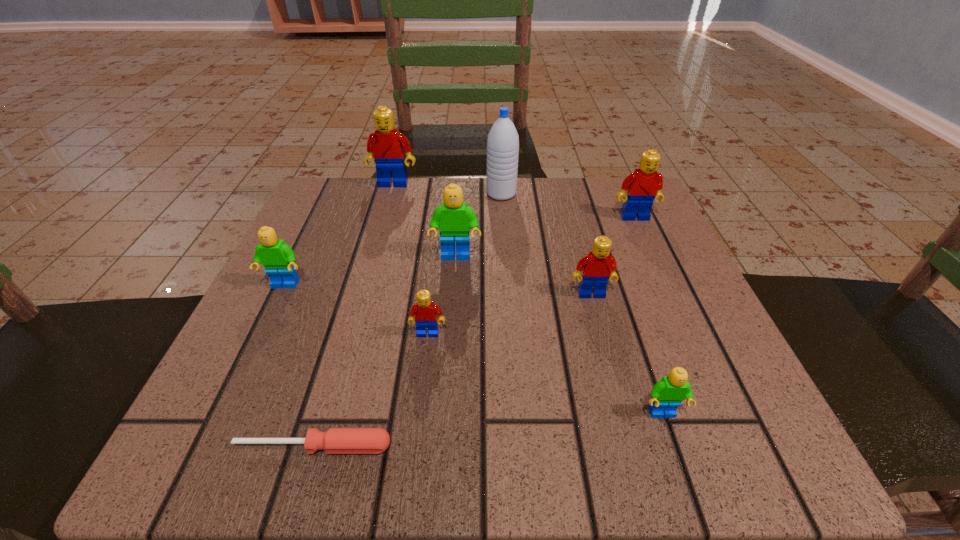
This screenshot has height=540, width=960. What are the coordinates of `the leftmost green Lego` in the screenshot? It's located at [x=278, y=258].

Locate an element on the screen. Image resolution: width=960 pixels, height=540 pixels. the second biggest green Lego is located at coordinates (278, 258).

You are a GUI agent. You are given a task and a screenshot of the screen. Output one action in this format:
    pyautogui.click(x=<x>, y=<y>)
    Task: Click on the sixth farthest Lego
    Image resolution: width=960 pixels, height=540 pixels.
    Given the screenshot: What is the action you would take?
    pyautogui.click(x=425, y=312)

Find the location of a particular element. Image resolution: width=960 pixels, height=540 pixels. the smallest red Lego is located at coordinates (425, 312).

At what (x,y) coordinates should I click in order to perform the action: click on the nearest green Lego. Please return your answer as a coordinate pair (x, y). This screenshot has height=540, width=960. Looking at the image, I should click on (666, 396).

At what (x,y) coordinates should I click in order to perform the action: click on the eighth farthest object. Please return your answer as a coordinate pair (x, y). The image size is (960, 540). Looking at the image, I should click on (666, 396).

Identify the location of the shortest object. (335, 440).

In order to click on screwdriver in this screenshot , I will do `click(335, 440)`.

Find the location of a particular element. This screenshot has height=540, width=960. blank area located 0.230m on the right of the water bottle is located at coordinates (618, 194).

Identify the location of vacant space located on the front-facing side of the farthest Lego. The height and width of the screenshot is (540, 960). (357, 312).